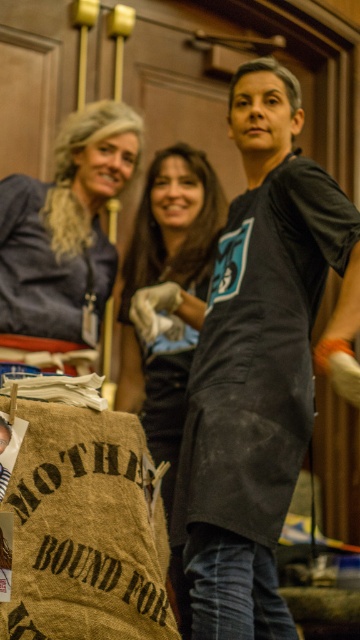
Question: Where is black matte apron at center located in relation to black matte shirt at center in the image?

Choices:
 (A) left
 (B) right

Answer: (B)

Question: Which point is farther from the camera taking this photo?

Choices:
 (A) (21, 300)
 (B) (149, 376)
 (C) (272, 262)

Answer: (B)

Question: Estimate the real-world distances between objects in this image. Which object is closer to the black matte shirt at center?

Choices:
 (A) black matte apron at center
 (B) matte blue shirt at left

Answer: (B)

Question: Does black matte apron at center come behind matte blue shirt at left?

Choices:
 (A) no
 (B) yes

Answer: (A)

Question: Can you confirm if matte blue shirt at left is positioned to the right of black matte shirt at center?

Choices:
 (A) yes
 (B) no

Answer: (B)

Question: Among these objects, which one is farthest from the camera?

Choices:
 (A) black matte shirt at center
 (B) matte blue shirt at left
 (C) black matte apron at center

Answer: (B)